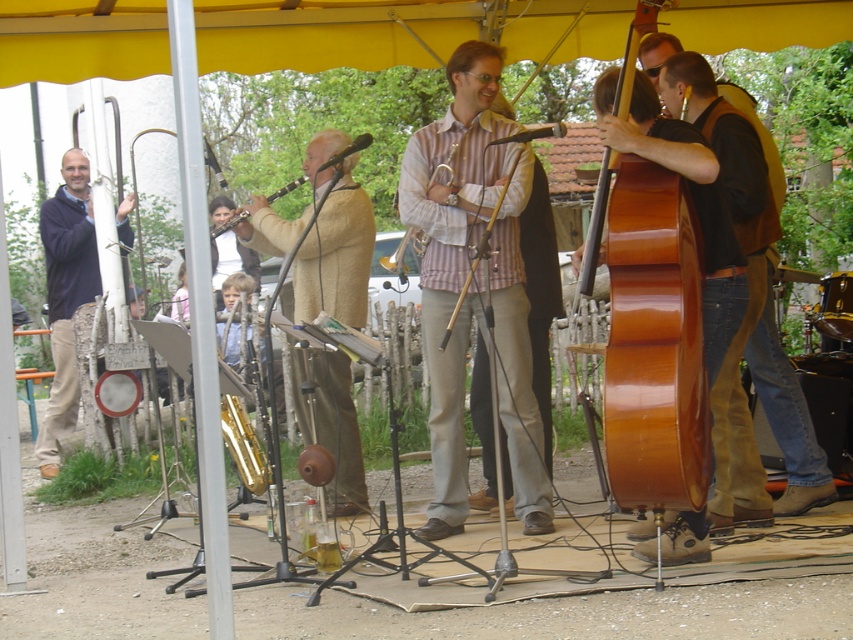
Measure the distance from striped cotton shirt at center to shiny brown cello at center.

striped cotton shirt at center is 81.98 centimeters from shiny brown cello at center.

Who is higher up, striped cotton shirt at center or shiny brown cello at center?

Positioned higher is shiny brown cello at center.

Describe the element at coordinates (473, 285) in the screenshot. Image resolution: width=853 pixels, height=640 pixels. I see `striped cotton shirt at center` at that location.

You are a GUI agent. You are given a task and a screenshot of the screen. Output one action in this format:
    pyautogui.click(x=<x>, y=<y>)
    Task: Click on the striped cotton shirt at center
    The image size is (853, 640).
    Given the screenshot: What is the action you would take?
    pyautogui.click(x=473, y=285)

What do you see at coordinates (477, 256) in the screenshot? This screenshot has width=853, height=640. I see `wooden cello at center` at bounding box center [477, 256].

Is wooden cello at center thinner than matte wood clarinet at center?

Correct, wooden cello at center's width is less than matte wood clarinet at center's.

Does point (537, 70) come closer to viewer compared to point (283, 193)?

No, (537, 70) is further to viewer.

The width and height of the screenshot is (853, 640). Find the location of `wooden cello at center`. wooden cello at center is located at coordinates (477, 256).

Does striped cotton shirt at center appear on the left side of matte blue sweater at left?

Incorrect, striped cotton shirt at center is not on the left side of matte blue sweater at left.

Can you confirm if striped cotton shirt at center is positioned above matte blue sweater at left?

No.

Image resolution: width=853 pixels, height=640 pixels. What are the coordinates of `striped cotton shirt at center` in the screenshot? It's located at (473, 285).